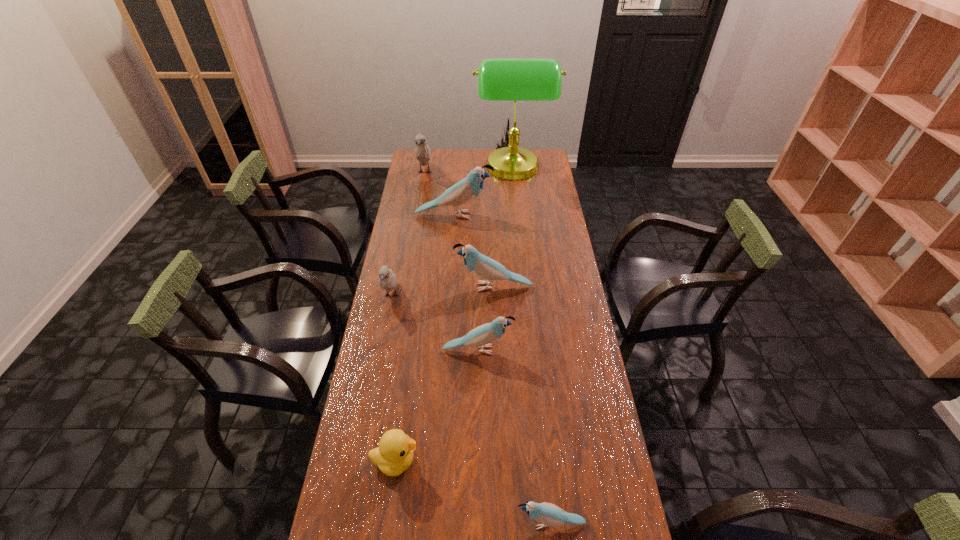
Find the location of a particular element. duck located in the left edge section of the desktop is located at coordinates (394, 455).

Identify the location of lamp that is positioned at the right edge. The width and height of the screenshot is (960, 540). [499, 79].

At what (x,y) coordinates should I click in order to perform the action: click on bird that is positioned at the right edge. Please return your answer as a coordinate pair (x, y). Looking at the image, I should click on (547, 514).

Locate an element on the screen. This screenshot has height=540, width=960. object located at the far left corner is located at coordinates (422, 151).

Where is `object that is positioned at the far right corner`? This screenshot has width=960, height=540. object that is positioned at the far right corner is located at coordinates (499, 79).

Find the location of a particular element. The height and width of the screenshot is (540, 960). free region at the left edge is located at coordinates (x=402, y=350).

Locate an element on the screen. The width and height of the screenshot is (960, 540). vacant space at the right edge is located at coordinates (611, 433).

Locate an element on the screen. free space at the far right corner of the desktop is located at coordinates coord(550,171).

This screenshot has height=540, width=960. Find the location of `vacant area that lies between the biggest blue bird and the nearest blue bird`. vacant area that lies between the biggest blue bird and the nearest blue bird is located at coordinates (502, 369).

Where is `free space that is in between the third nearest blue bird and the bigger white bird`? Image resolution: width=960 pixels, height=540 pixels. free space that is in between the third nearest blue bird and the bigger white bird is located at coordinates (459, 230).